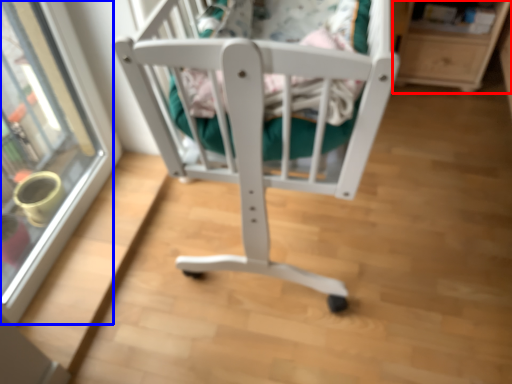
Question: Which of the following is the farthest to the observer, shelf (highlighted by a red box) or glass door (highlighted by a blue box)?

Choices:
 (A) shelf
 (B) glass door

Answer: (A)